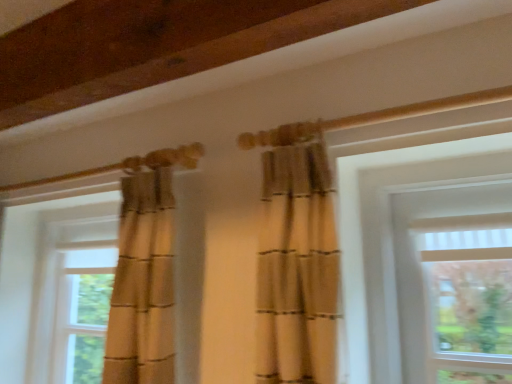
Question: From the image's perspective, is matte beige curtain at left, the 1th window in the right-to-left sequence, located above or below translucent glass window at left, the 2th window viewed from the right?

Choices:
 (A) below
 (B) above

Answer: (B)

Question: Considering the positions of point (138, 163) and point (74, 349), is point (138, 163) closer or farther from the camera than point (74, 349)?

Choices:
 (A) closer
 (B) farther

Answer: (A)

Question: Is matte beige curtain at left, the 1th window in the right-to-left sequence, inside the boundaries of translucent glass window at left, arranged as the first window when viewed from the left, or outside?

Choices:
 (A) inside
 (B) outside

Answer: (B)

Question: Is translucent glass window at left, the 2th window viewed from the right, situated inside matte beige curtain at left, the 1th window in the right-to-left sequence, or outside?

Choices:
 (A) outside
 (B) inside

Answer: (B)

Question: Is point (77, 269) closer or farther from the camera than point (150, 296)?

Choices:
 (A) closer
 (B) farther

Answer: (B)

Question: Visually, is translucent glass window at left, arranged as the first window when viewed from the left, positioned to the left or to the right of matte beige curtain at left, arranged as the second window when viewed from the left?

Choices:
 (A) left
 (B) right

Answer: (A)

Question: Considering their positions, is translucent glass window at left, arranged as the first window when viewed from the left, located in front of or behind matte beige curtain at left, the 1th window in the right-to-left sequence?

Choices:
 (A) behind
 (B) front

Answer: (A)